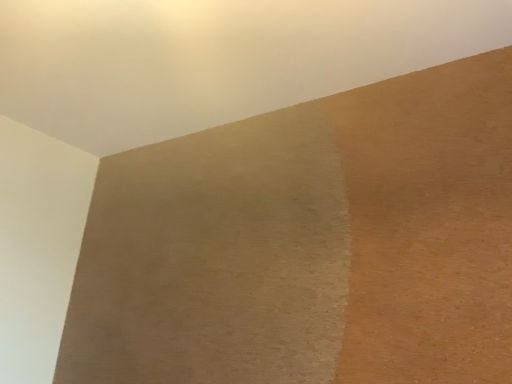
What do you see at coordinates (215, 59) in the screenshot? Image resolution: width=512 pixels, height=384 pixels. I see `smooth beige wall at upper left` at bounding box center [215, 59].

You are a GUI agent. You are given a task and a screenshot of the screen. Output one action in this format:
    pyautogui.click(x=<x>, y=<y>)
    Task: Click on the smooth beige wall at upper left
    This screenshot has height=384, width=512.
    Given the screenshot: What is the action you would take?
    pyautogui.click(x=215, y=59)

Measure the distance between smooth beige wall at upper left and camera.

smooth beige wall at upper left is 1.20 meters from camera.

Find the location of a particular element. This screenshot has height=384, width=512. smooth beige wall at upper left is located at coordinates (215, 59).